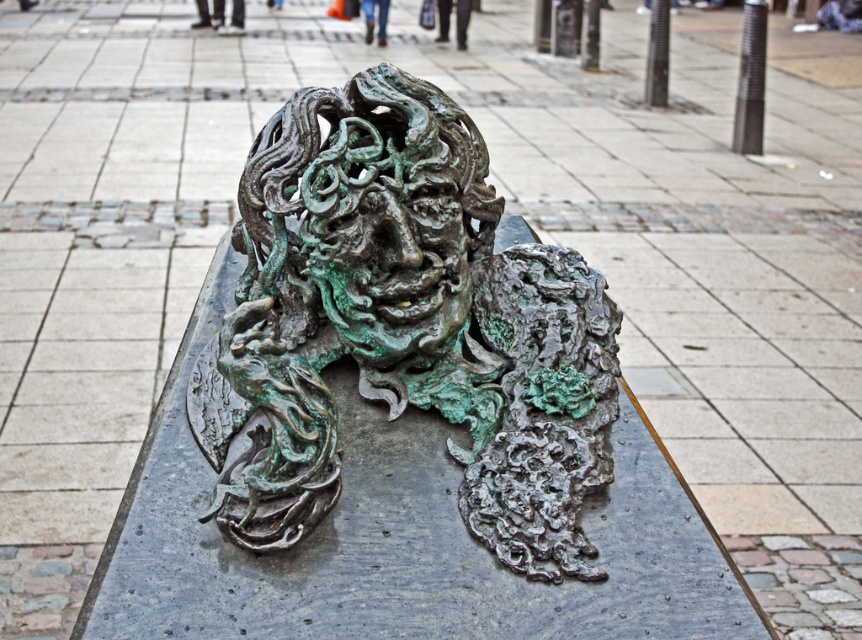
Which is more to the left, green patina bronze sculpture at center or green patina bronze face at center?

From the viewer's perspective, green patina bronze sculpture at center appears more on the left side.

How much distance is there between green patina bronze sculpture at center and green patina bronze face at center?

A distance of 6.75 centimeters exists between green patina bronze sculpture at center and green patina bronze face at center.

What do you see at coordinates (403, 328) in the screenshot?
I see `green patina bronze sculpture at center` at bounding box center [403, 328].

Locate an element on the screen. green patina bronze sculpture at center is located at coordinates [403, 328].